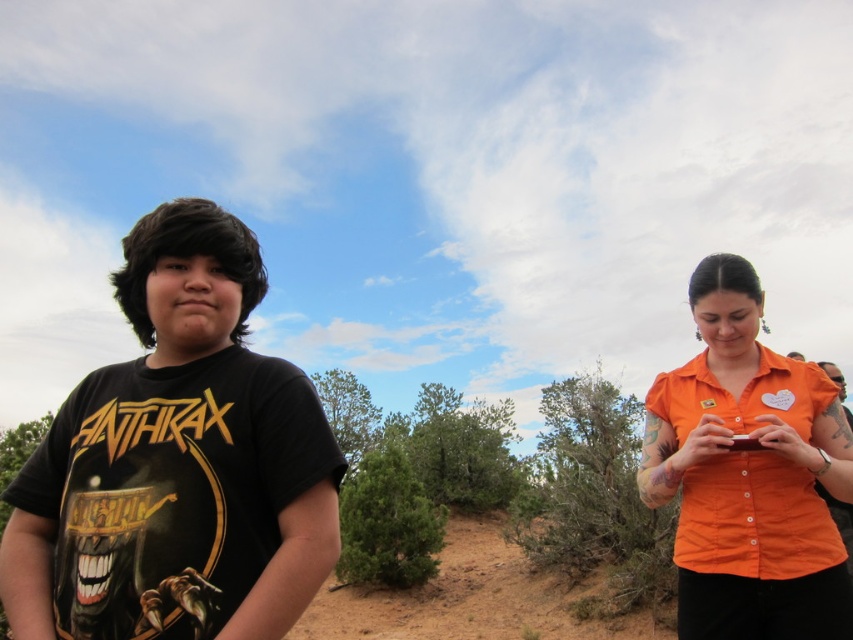
Question: Is black matte t-shirt at left above brown sandy dirt track at center?

Choices:
 (A) yes
 (B) no

Answer: (A)

Question: Which object is positioned closest to the brown sandy dirt track at center?

Choices:
 (A) black matte t-shirt at left
 (B) orange button-down shirt at right

Answer: (B)

Question: Estimate the real-world distances between objects in this image. Which object is farther from the brown sandy dirt track at center?

Choices:
 (A) orange button-down shirt at right
 (B) black matte t-shirt at left

Answer: (B)

Question: Does black matte t-shirt at left appear on the left side of orange button-down shirt at right?

Choices:
 (A) no
 (B) yes

Answer: (B)

Question: Can you confirm if black matte t-shirt at left is bigger than brown sandy dirt track at center?

Choices:
 (A) yes
 (B) no

Answer: (A)

Question: Estimate the real-world distances between objects in this image. Which object is closer to the brown sandy dirt track at center?

Choices:
 (A) black matte t-shirt at left
 (B) orange button-down shirt at right

Answer: (B)